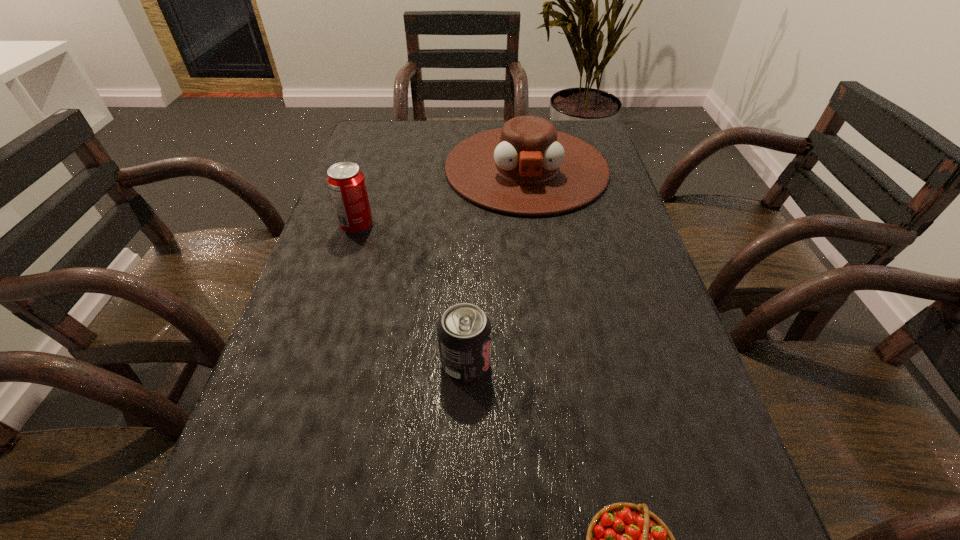
This screenshot has height=540, width=960. What are the coordinates of `object present at the right edge` in the screenshot? It's located at (528, 168).

Identify the location of object that is at the far right corner. (528, 168).

I want to click on vacant space at the far edge of the desktop, so click(x=435, y=160).

Image resolution: width=960 pixels, height=540 pixels. In the image, there is a desktop. Find the location of `vacant space at the left edge`. vacant space at the left edge is located at coordinates (364, 313).

This screenshot has height=540, width=960. I want to click on free spot at the right edge of the desktop, so click(582, 237).

The image size is (960, 540). In the image, there is a desktop. Find the location of `vacant space at the far left corner`. vacant space at the far left corner is located at coordinates (390, 130).

Find the location of a particular element. This screenshot has width=960, height=540. free spot between the cowboy hat and the tallest object is located at coordinates (442, 197).

You are a GUI agent. You are given a task and a screenshot of the screen. Output one action in this format:
    pyautogui.click(x=<x>, y=<y>)
    Task: Click on the free space that is in between the shorter soda can and the cowboy hat
    
    Given the screenshot: What is the action you would take?
    pyautogui.click(x=496, y=265)

At what (x,y) coordinates should I click in order to perform the action: click on unoccupied area between the nearer soda can and the cowboy hat. Please return your answer as a coordinate pair (x, y). Looking at the image, I should click on (496, 265).

Find the location of a particular element. This screenshot has height=540, width=960. empty space that is in between the right soda can and the tallest object is located at coordinates (411, 294).